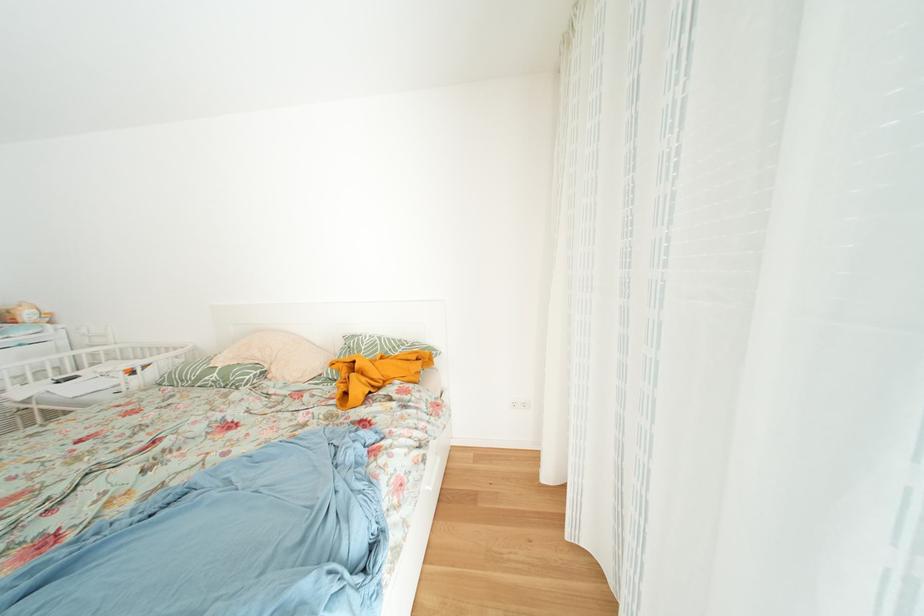
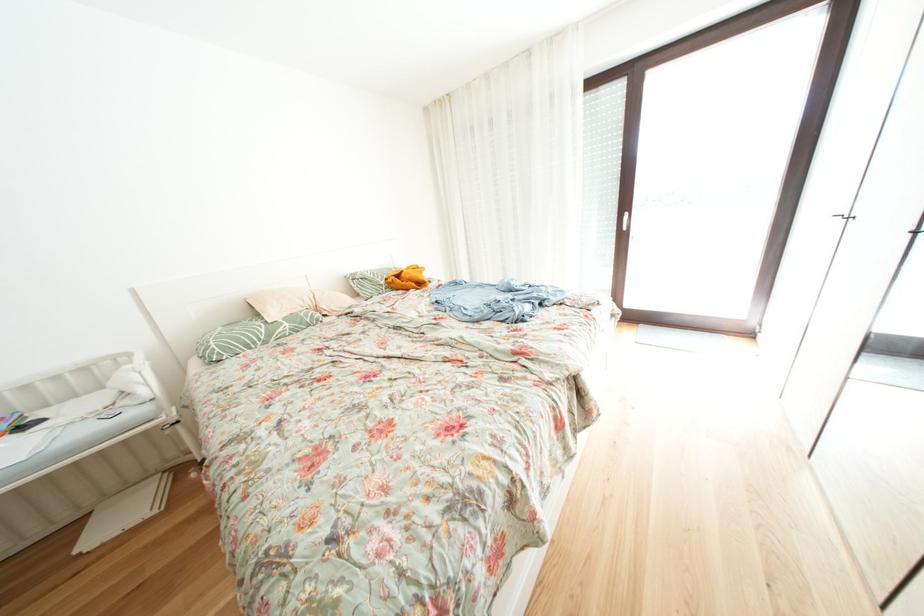
The point at (225,379) is marked in the first image. Where is the corresponding point in the second image?

(296, 329)